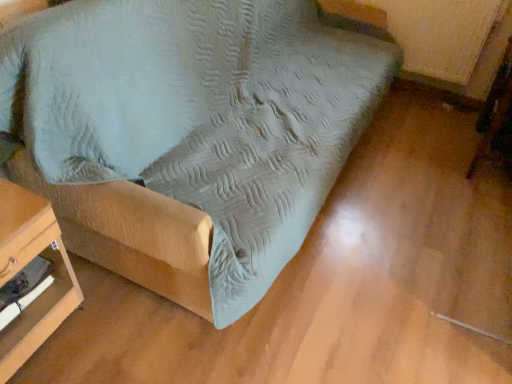
This screenshot has width=512, height=384. What are the coordinates of `vacant space to the right of suede-like fabric couch at center, placed as the 1th furniture when sorted from right to left` in the screenshot? It's located at (421, 190).